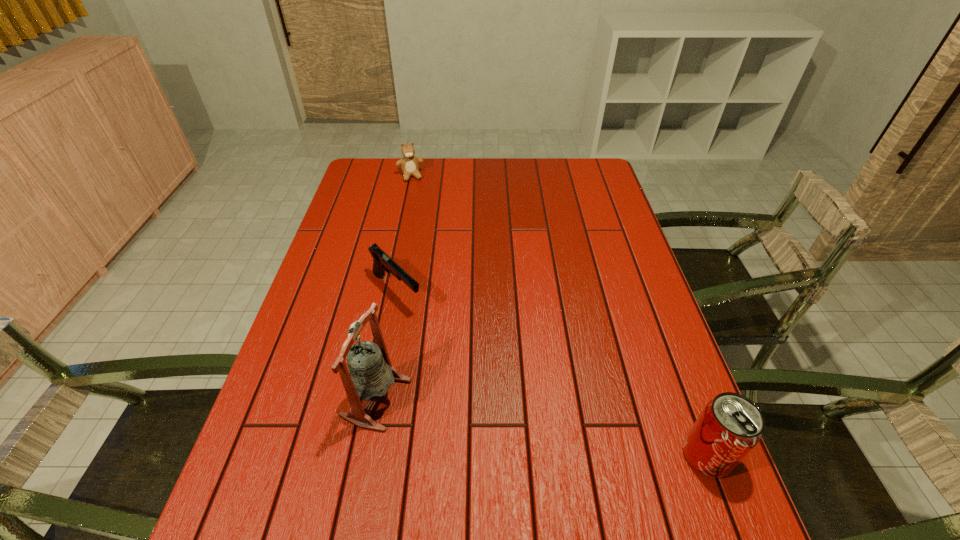
Where is `the tallest object`? This screenshot has width=960, height=540. the tallest object is located at coordinates (370, 374).

Image resolution: width=960 pixels, height=540 pixels. Identify the location of pop soda. pyautogui.click(x=729, y=427).

Locate an element on the screen. the rightmost object is located at coordinates (729, 427).

Where is `the farthest object`? This screenshot has width=960, height=540. the farthest object is located at coordinates coord(409,163).

Identify the location of gun. The width and height of the screenshot is (960, 540). (382, 262).

Locate an element on the screen. vacant space situated on the right of the bell is located at coordinates (445, 399).

At what (x,y) coordinates should I click in order to perform the action: click on vacant space located on the left of the pop soda. Please return your answer as a coordinate pair (x, y). Image resolution: width=960 pixels, height=540 pixels. Looking at the image, I should click on (503, 455).

At what (x,y) coordinates should I click in order to perform the action: click on blank space located on the front-facing side of the teddy bear. Please return your answer as a coordinate pair (x, y). The height and width of the screenshot is (540, 960). Looking at the image, I should click on (426, 226).

In order to click on free space located 0.160m on the front-facing side of the teddy bear in this screenshot , I will do `click(420, 207)`.

The image size is (960, 540). I want to click on blank space located 0.130m on the front-facing side of the teddy bear, so click(x=419, y=202).